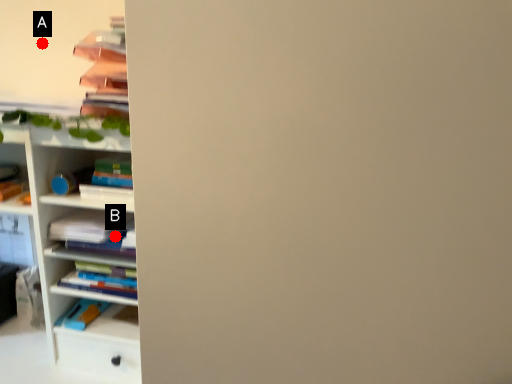
Question: Two points are circled on the image, labeled by A and B beside each circle. Which of the following is the farthest from the observer?

Choices:
 (A) A is further
 (B) B is further

Answer: (A)